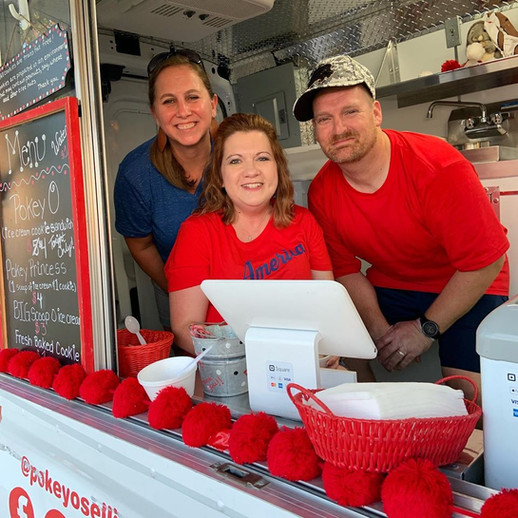
Find the location of a particular element. The image size is (518, 518). basket is located at coordinates (390, 447), (131, 357).